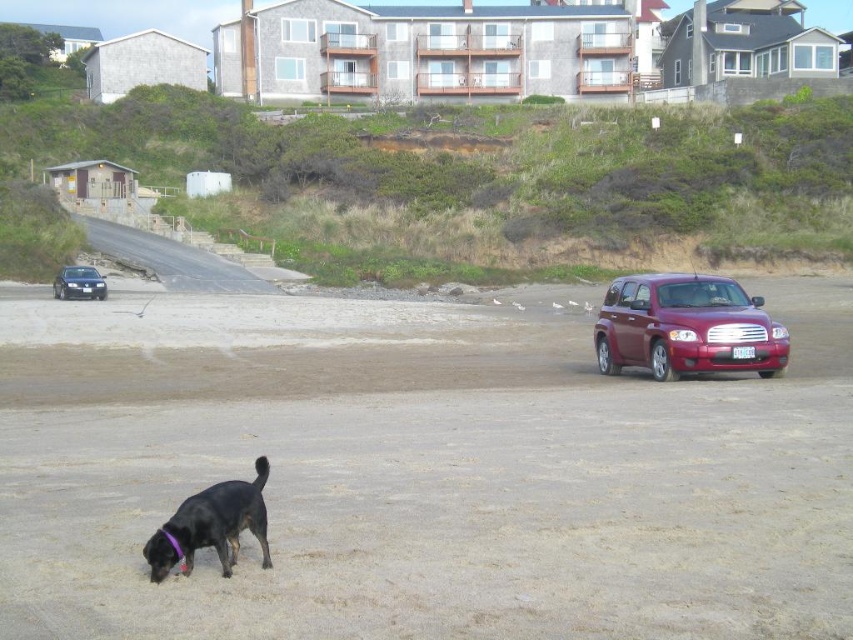
Between black fur dog at lower left and shiny black sedan at left, which one is positioned lower?

black fur dog at lower left is lower down.

How far apart are black fur dog at lower left and shiny black sedan at left?

The distance of black fur dog at lower left from shiny black sedan at left is 37.16 meters.

Between point (263, 547) and point (57, 276), which one is positioned behind?

The point (57, 276) is more distant.

Identify the location of black fur dog at lower left. Image resolution: width=853 pixels, height=640 pixels. (212, 525).

Does shiny maroon suv at right have a larger size compared to shiny black sedan at left?

Yes.

Does shiny maroon suv at right have a smaller size compared to shiny black sedan at left?

No, shiny maroon suv at right is not smaller than shiny black sedan at left.

Does point (728, 326) come closer to viewer compared to point (74, 294)?

Yes, it is.

The width and height of the screenshot is (853, 640). Find the location of `shiny maroon suv at right`. shiny maroon suv at right is located at coordinates (686, 326).

Which is above, sandy beach at lower center or shiny black sedan at left?

shiny black sedan at left is higher up.

Describe the element at coordinates (421, 472) in the screenshot. I see `sandy beach at lower center` at that location.

Which is behind, point (788, 522) or point (85, 291)?

The point (85, 291) is behind.

At what (x,y) coordinates should I click in order to perform the action: click on sandy beach at lower center. Please return your answer as a coordinate pair (x, y). Looking at the image, I should click on (421, 472).